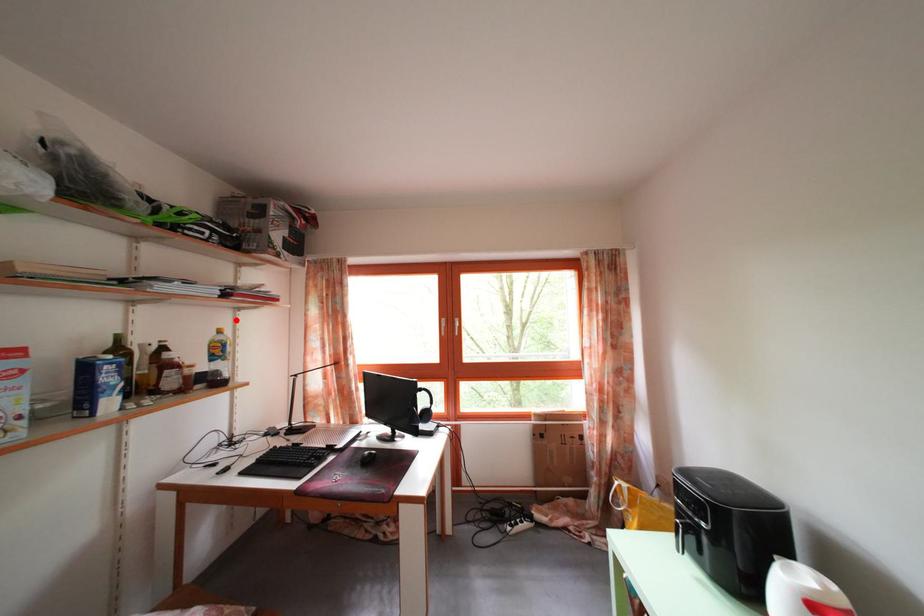
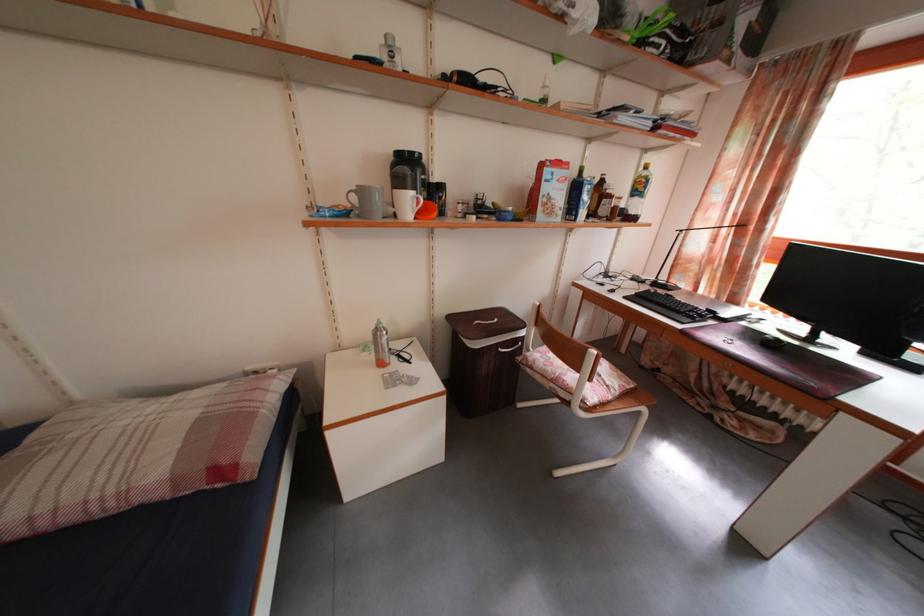
Question: I am providing you with two images of the same scene from different viewpoints. Image1 has a red point marked. In image2, the corresponding 3D location appears at what relative position? Reply with the corresponding letter.

Choices:
 (A) Closer
 (B) Farther

Answer: (A)